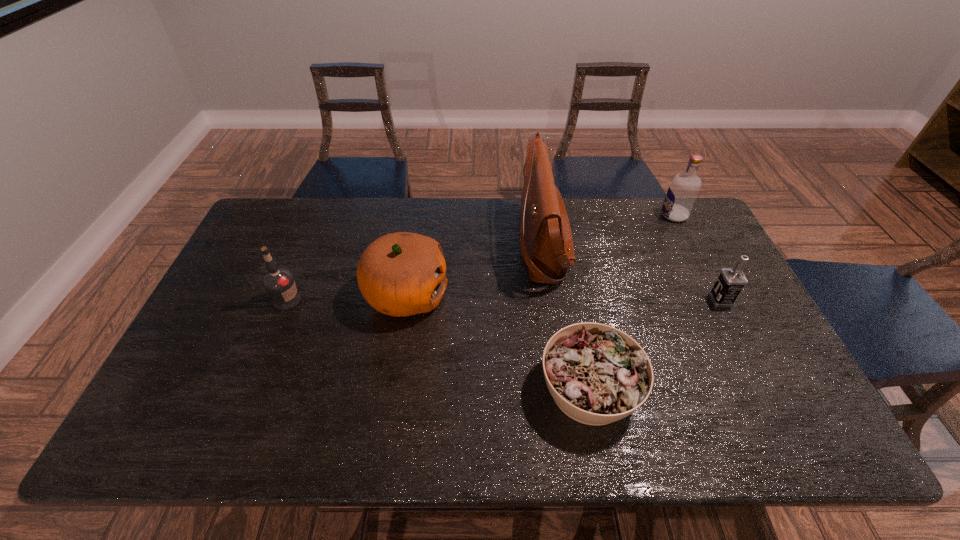
Locate an element on the screen. vacant position located on the label of the farthest vodka is located at coordinates (584, 215).

Identify the location of free region located 0.380m on the label of the farthest vodka. This screenshot has width=960, height=540. (552, 215).

This screenshot has width=960, height=540. I want to click on blank space located on the label of the farthest vodka, so click(x=640, y=215).

The height and width of the screenshot is (540, 960). What are the coordinates of `vacant point located 0.060m on the front label of the leftmost object` in the screenshot? It's located at (323, 301).

Locate an element on the screen. This screenshot has width=960, height=540. vacant area located 0.310m on the face of the second object from left to right is located at coordinates (554, 295).

The width and height of the screenshot is (960, 540). Find the location of `vacant space located on the front label of the second shortest object`. vacant space located on the front label of the second shortest object is located at coordinates click(x=587, y=300).

You are a GUI agent. You are given a task and a screenshot of the screen. Output one action in this format:
    pyautogui.click(x=<x>, y=<y>)
    Task: Click on the vacant space located on the front label of the second shortest object
    The width and height of the screenshot is (960, 540).
    Given the screenshot: What is the action you would take?
    pyautogui.click(x=684, y=300)

At what (x,y) coordinates should I click in order to perform the action: click on free space located on the front label of the second shortest object. Please return your answer as a coordinate pair (x, y). This screenshot has height=540, width=960. Looking at the image, I should click on (680, 300).

Locate an element on the screen. The width and height of the screenshot is (960, 540). vacant space positioned 0.340m on the right of the shortest object is located at coordinates (780, 389).

Identify the location of satchel located at the far edge. The image size is (960, 540). (549, 251).